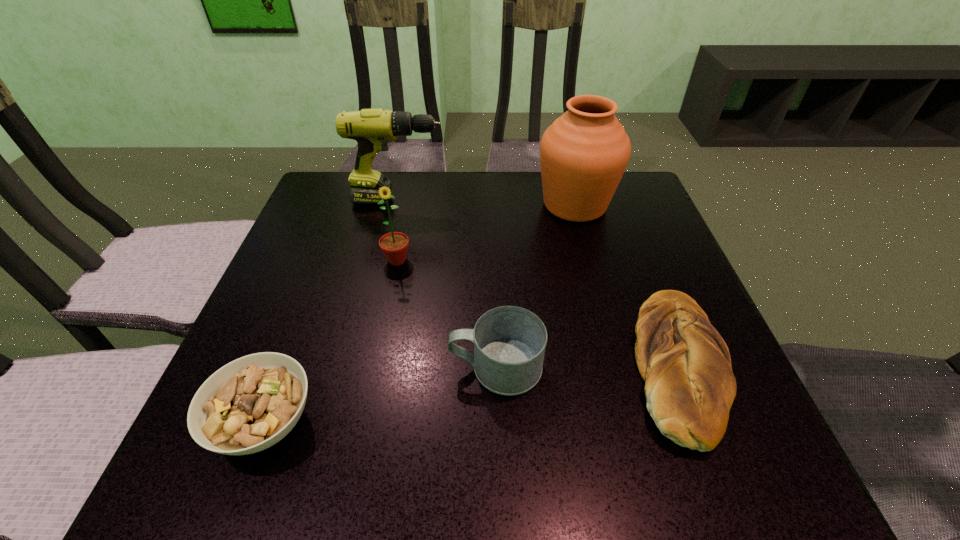
Where is `free point located 0.290m on the face of the third farthest object`? The image size is (960, 540). free point located 0.290m on the face of the third farthest object is located at coordinates (372, 387).

The image size is (960, 540). Find the location of `vacant area situated 0.210m on the side of the mug with the handle`. vacant area situated 0.210m on the side of the mug with the handle is located at coordinates (330, 367).

Where is `vacant space located on the side of the mug with the handle`? The height and width of the screenshot is (540, 960). vacant space located on the side of the mug with the handle is located at coordinates (268, 367).

Locate an element on the screen. free space located 0.230m on the side of the mug with the handle is located at coordinates (319, 367).

Where is `free location located on the right of the stew`? This screenshot has width=960, height=540. free location located on the right of the stew is located at coordinates (519, 422).

Where is `free space located on the back of the bread`? free space located on the back of the bread is located at coordinates (618, 208).

The width and height of the screenshot is (960, 540). I want to click on urn that is positioned at the far edge, so click(x=583, y=154).

You are a GUI agent. You are given a task and a screenshot of the screen. Output one action in this format:
    pyautogui.click(x=<x>, y=<y>)
    Task: Click on the drill at the far edge
    
    Given the screenshot: What is the action you would take?
    pyautogui.click(x=372, y=128)

The height and width of the screenshot is (540, 960). Identify the location of stew that is at the near edge. (248, 405).

Identify the location of bread located in the near edge section of the desktop. (689, 385).